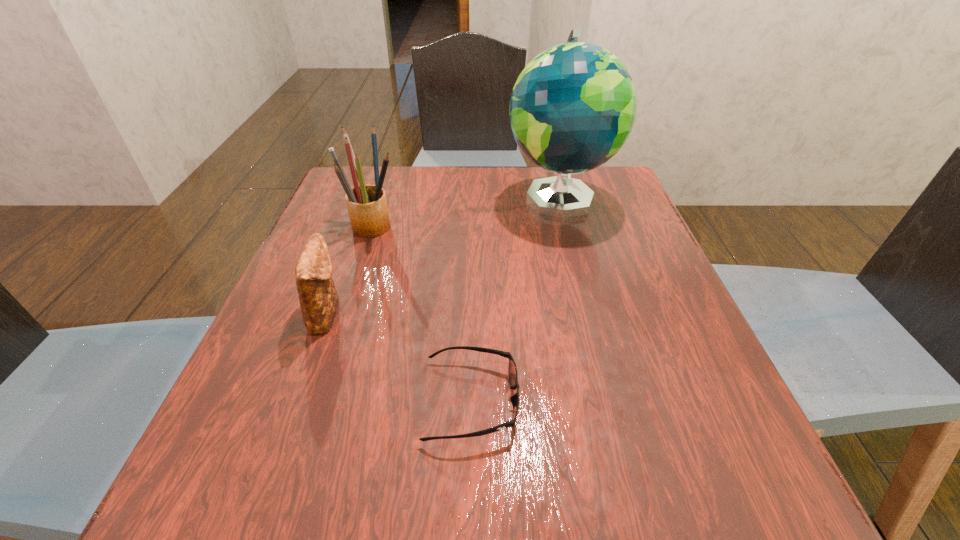
In the image, there is a desktop. Identify the location of vacant space at the right edge. The image size is (960, 540). (693, 444).

The image size is (960, 540). Identify the location of free spot at the far right corner of the desktop. (595, 172).

Identify the location of empty space between the tallest object and the third shortest object. This screenshot has height=540, width=960. (467, 211).

Locate an element on the screen. This screenshot has width=960, height=540. vacant space that's between the globe and the second tallest object is located at coordinates (467, 211).

Locate an element on the screen. The image size is (960, 540). vacant area that lies between the globe and the second tallest object is located at coordinates (467, 211).

Find the location of a particular element. This screenshot has height=540, width=960. free space between the globe and the pencil box is located at coordinates (467, 211).

Locate an element on the screen. The image size is (960, 540). free space between the rightmost object and the pencil box is located at coordinates (467, 211).

You are a GUI agent. You are given a task and a screenshot of the screen. Output one action in this format:
    pyautogui.click(x=<x>, y=<y>)
    Task: Click on the free space between the second nearest object and the nearest object
    The image size is (960, 540).
    Given the screenshot: What is the action you would take?
    pyautogui.click(x=399, y=356)

This screenshot has height=540, width=960. I want to click on free spot between the third shortest object and the nearest object, so click(x=423, y=313).

Image resolution: width=960 pixels, height=540 pixels. Find the location of `empty space that is in between the second object from right to left and the tallest object`. empty space that is in between the second object from right to left and the tallest object is located at coordinates (516, 299).